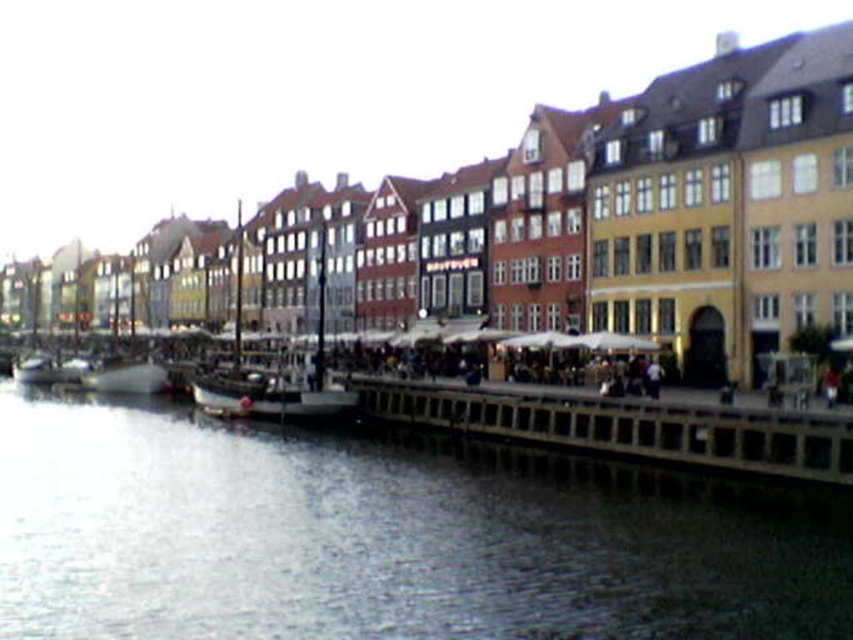
Which is below, wooden ship at center or metallic silver boat at left?

Positioned lower is metallic silver boat at left.

Can you confirm if wooden ship at center is shorter than metallic silver boat at left?

Incorrect, wooden ship at center's height does not fall short of metallic silver boat at left's.

The image size is (853, 640). What are the coordinates of `wooden ship at center` in the screenshot? It's located at (277, 380).

Does clear water at lower left lie in front of wooden dock at lower center?

Yes, it is in front of wooden dock at lower center.

Image resolution: width=853 pixels, height=640 pixels. What are the coordinates of `clear water at lower left` in the screenshot? It's located at (366, 541).

Does wooden dock at lower center have a larger size compared to metallic silver boat at left?

Correct, wooden dock at lower center is larger in size than metallic silver boat at left.

Between wooden dock at lower center and metallic silver boat at left, which one has less height?

With less height is metallic silver boat at left.

Who is more forward, (827, 460) or (155, 368)?

Positioned in front is point (827, 460).

What are the coordinates of `wooden dock at lower center` in the screenshot? It's located at (624, 426).